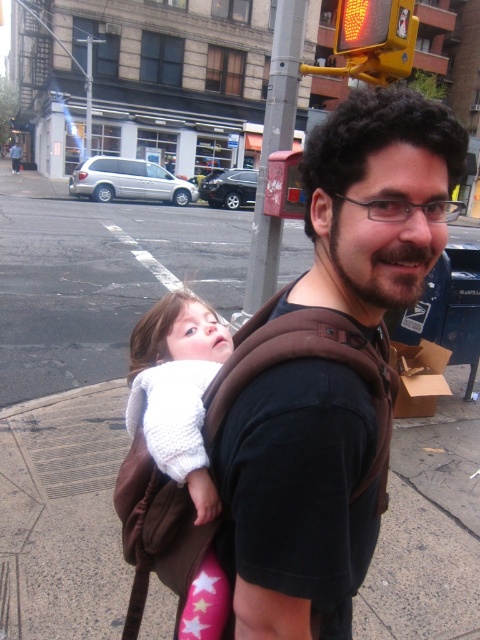
Does brown fabric carrier at center appear over white knitted sweater at center?

Yes.

Who is positioned more to the right, brown fabric carrier at center or white knitted sweater at center?

Positioned to the right is brown fabric carrier at center.

Is point (364, 433) closer to camera compared to point (197, 358)?

Yes.

Image resolution: width=480 pixels, height=640 pixels. I want to click on brown fabric carrier at center, so click(297, 499).